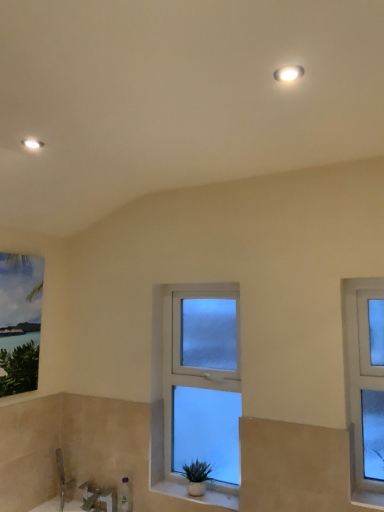
This screenshot has height=512, width=384. Describe the element at coordinates (197, 477) in the screenshot. I see `green matte plant at center` at that location.

What do you see at coordinates (200, 387) in the screenshot? I see `clear glass window at center, positioned as the second window in right-to-left order` at bounding box center [200, 387].

In order to face white ceramic window sill at center, should I rotate leftwards or rightwards?

You should rotate right by 1.056 degrees.

Identify the location of green matte plant at center. (197, 477).

From a real-world perspective, which is physically below, clear glass window at center, acting as the first window starting from the back, or white ceramic window sill at center?

white ceramic window sill at center, from a real-world perspective.

Is clear glass window at center, positioned as the second window in right-to-left order, positioned far away from white ceramic window sill at center?

clear glass window at center, positioned as the second window in right-to-left order, is near white ceramic window sill at center, not far away.

Can you tell me how much clear glass window at center, acting as the first window starting from the back, and white ceramic window sill at center differ in facing direction?

The facing directions of clear glass window at center, acting as the first window starting from the back, and white ceramic window sill at center are 2.01e-05 degrees apart.

Based on the photo, does clear glass window at center, arranged as the second window when viewed from the front, lie behind white ceramic window sill at center?

Yes, it is behind white ceramic window sill at center.

Is green matte plant at center bigger than clear glass window at right, acting as the first window starting from the right?

Indeed, green matte plant at center has a larger size compared to clear glass window at right, acting as the first window starting from the right.

From the image's perspective, is green matte plant at center positioned above or below clear glass window at right, the 1th window in the front-to-back sequence?

Based on their image positions, green matte plant at center is located beneath clear glass window at right, the 1th window in the front-to-back sequence.

Can you tell me how much green matte plant at center and clear glass window at right, acting as the first window starting from the right, differ in facing direction?

The angular difference between green matte plant at center and clear glass window at right, acting as the first window starting from the right, is 0.000188 degrees.

Which is behind, green matte plant at center or clear glass window at right, acting as the first window starting from the right?

green matte plant at center is behind.

Consider the image. What's the angular difference between matte white recessed light at upper left, positioned as the second light fixture in right-to-left order, and clear glass window at center, positioned as the second window in right-to-left order,'s facing directions?

The angle between the facing direction of matte white recessed light at upper left, positioned as the second light fixture in right-to-left order, and the facing direction of clear glass window at center, positioned as the second window in right-to-left order, is 90 degrees.

From the image's perspective, count 2nd windows downward from the matte white recessed light at upper left, which is counted as the 1th light fixture, starting from the bottom, and point to it. Please provide its 2D coordinates.

[(200, 387)]

Does matte white recessed light at upper left, arranged as the first light fixture when viewed from the left, lie in front of clear glass window at center, positioned as the second window in right-to-left order?

Yes, matte white recessed light at upper left, arranged as the first light fixture when viewed from the left, is closer to the viewer.

Would you say clear glass window at center, arranged as the second window when viewed from the front, is part of matte white recessed light at upper left, placed as the second light fixture when sorted from front to back,'s contents?

No, clear glass window at center, arranged as the second window when viewed from the front, is not a part of matte white recessed light at upper left, placed as the second light fixture when sorted from front to back.

The height and width of the screenshot is (512, 384). Find the location of `window below the clear glass window at right, which is counted as the second window, starting from the back (from the image's perspective)`. window below the clear glass window at right, which is counted as the second window, starting from the back (from the image's perspective) is located at coordinates (200, 387).

Between point (171, 366) and point (367, 435), which one is positioned behind?

The point (171, 366) is farther.

Which object is thinner, clear glass window at center, positioned as the second window in right-to-left order, or clear glass window at right, the 1th window in the front-to-back sequence?

clear glass window at right, the 1th window in the front-to-back sequence.

From the image's perspective, is clear glass window at center, arranged as the second window when viewed from the front, on top of clear glass window at right, the 1th window in the front-to-back sequence?

Actually, clear glass window at center, arranged as the second window when viewed from the front, appears below clear glass window at right, the 1th window in the front-to-back sequence, in the image.

Consider the image. How different are the orientations of white glossy light fixture at upper center, which is the second light fixture in back-to-front order, and clear glass window at right, acting as the first window starting from the right, in degrees?

They differ by 90 degrees in their facing directions.

Which point is more forward, (277, 75) or (352, 379)?

The point (277, 75) is more forward.

From a real-world perspective, which is physically above, white glossy light fixture at upper center, the first light fixture when ordered from front to back, or clear glass window at right, which is counted as the second window, starting from the back?

In real-world perspective, white glossy light fixture at upper center, the first light fixture when ordered from front to back, is above.

Consider the image. From a real-world perspective, which is physically below, white ceramic window sill at center or clear glass window at right, acting as the first window starting from the right?

white ceramic window sill at center is physically lower.

Is white ceramic window sill at center spatially inside clear glass window at right, the 1th window in the front-to-back sequence, or outside of it?

white ceramic window sill at center lies outside clear glass window at right, the 1th window in the front-to-back sequence.

Which window is the 2nd one when counting from the right side of the white ceramic window sill at center? Please provide its 2D coordinates.

[(365, 386)]

From the image's perspective, between clear glass window at center, which is the 1th window in left-to-right order, and matte white recessed light at upper left, placed as the second light fixture when sorted from front to back, who is located below?

clear glass window at center, which is the 1th window in left-to-right order, is shown below in the image.

Does clear glass window at center, acting as the first window starting from the back, touch matte white recessed light at upper left, the 2th light fixture positioned from the top?

No, clear glass window at center, acting as the first window starting from the back, is not making contact with matte white recessed light at upper left, the 2th light fixture positioned from the top.

Consider the image. Does clear glass window at center, acting as the first window starting from the back, turn towards matte white recessed light at upper left, positioned as the second light fixture in right-to-left order?

Yes, clear glass window at center, acting as the first window starting from the back, faces towards matte white recessed light at upper left, positioned as the second light fixture in right-to-left order.

Considering the positions of points (183, 335) and (33, 139), is point (183, 335) closer to camera compared to point (33, 139)?

That is False.

You are a GUI agent. You are given a task and a screenshot of the screen. Output one action in this format:
    pyautogui.click(x=<x>, y=<y>)
    Task: Click on the window sill directly beneath the clear glass window at center, positioned as the second window in right-to-left order (from a real-world perspective)
    
    Given the screenshot: What is the action you would take?
    pyautogui.click(x=196, y=497)

Find the location of a particular element. The image size is (384, 512). window that is the 2nd one when counting rightward from the green matte plant at center is located at coordinates (365, 386).

From the image, which object appears to be farther from clear glass window at right, acting as the first window starting from the right, clear glass window at center, positioned as the second window in right-to-left order, or green matte plant at center?

green matte plant at center is positioned further to the anchor clear glass window at right, acting as the first window starting from the right.

Consider the image. Which object lies nearer to the anchor point matte white recessed light at upper left, placed as the second light fixture when sorted from front to back, clear glass window at center, acting as the first window starting from the back, or green matte plant at center?

clear glass window at center, acting as the first window starting from the back.

When comparing their distances from matte white recessed light at upper left, which appears as the first light fixture when viewed from the back, does white glossy light fixture at upper center, the first light fixture when ordered from front to back, or white ceramic window sill at center seem further?

white ceramic window sill at center is positioned further to the anchor matte white recessed light at upper left, which appears as the first light fixture when viewed from the back.

Looking at the image, which one is located closer to white ceramic window sill at center, clear glass window at center, acting as the first window starting from the back, or green matte plant at center?

The object closer to white ceramic window sill at center is green matte plant at center.

When comparing their distances from matte white recessed light at upper left, which appears as the first light fixture when viewed from the back, does green matte plant at center or clear glass window at center, acting as the first window starting from the back, seem further?

green matte plant at center is positioned further to the anchor matte white recessed light at upper left, which appears as the first light fixture when viewed from the back.

Based on their spatial positions, is clear glass window at right, which is the 2th window in left-to-right order, or clear glass window at center, arranged as the second window when viewed from the front, further from matte white recessed light at upper left, which is counted as the 1th light fixture, starting from the bottom?

The object further to matte white recessed light at upper left, which is counted as the 1th light fixture, starting from the bottom, is clear glass window at right, which is the 2th window in left-to-right order.

Looking at the image, which one is located closer to clear glass window at center, positioned as the second window in right-to-left order, white glossy light fixture at upper center, which is the second light fixture in back-to-front order, or white ceramic window sill at center?

white ceramic window sill at center lies closer to clear glass window at center, positioned as the second window in right-to-left order, than the other object.

Based on their spatial positions, is clear glass window at center, which is the 1th window in left-to-right order, or matte white recessed light at upper left, the 2th light fixture positioned from the top, closer to white glossy light fixture at upper center, the 1th light fixture positioned from the right?

Among the two, matte white recessed light at upper left, the 2th light fixture positioned from the top, is located nearer to white glossy light fixture at upper center, the 1th light fixture positioned from the right.

Where is `light fixture between matte white recessed light at upper left, positioned as the second light fixture in right-to-left order, and clear glass window at right, the 1th window in the front-to-back sequence, from left to right`? The height and width of the screenshot is (512, 384). light fixture between matte white recessed light at upper left, positioned as the second light fixture in right-to-left order, and clear glass window at right, the 1th window in the front-to-back sequence, from left to right is located at coordinates (289, 73).

Where is `houseplant that lies between clear glass window at center, acting as the first window starting from the back, and white ceramic window sill at center from top to bottom`? This screenshot has width=384, height=512. houseplant that lies between clear glass window at center, acting as the first window starting from the back, and white ceramic window sill at center from top to bottom is located at coordinates (197, 477).

Identify the location of light fixture that lies between white glossy light fixture at upper center, which is the second light fixture in back-to-front order, and white ceramic window sill at center from top to bottom. (32, 143).

Locate an element on the screen. The height and width of the screenshot is (512, 384). window located between green matte plant at center and clear glass window at right, which is the 2th window in left-to-right order, in the left-right direction is located at coordinates (200, 387).